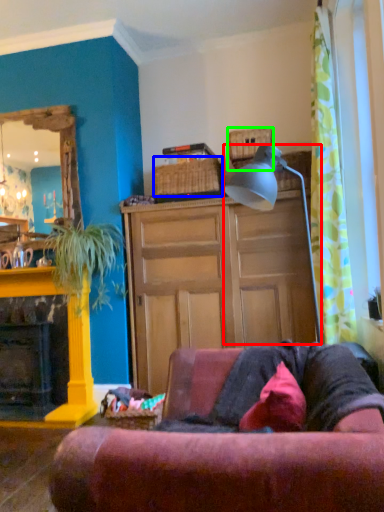
Question: Estimate the real-world distances between objects in this image. Which object is closer to lamp (highlighted by a red box), picnic basket (highlighted by a blue box) or picnic basket (highlighted by a green box)?

Choices:
 (A) picnic basket
 (B) picnic basket

Answer: (B)